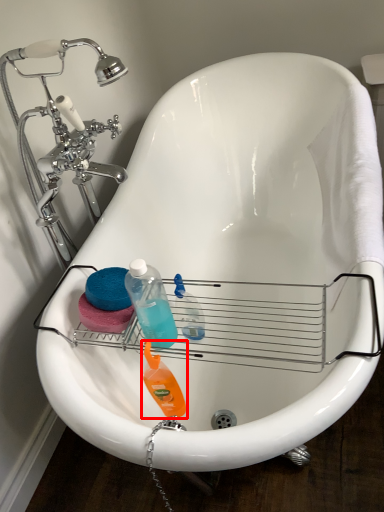
Question: From the image's perspective, considering the relative positions of cleaning product (annotated by the red box) and cleaning product in the image provided, where is cleaning product (annotated by the red box) located with respect to the staircase?

Choices:
 (A) above
 (B) below

Answer: (B)